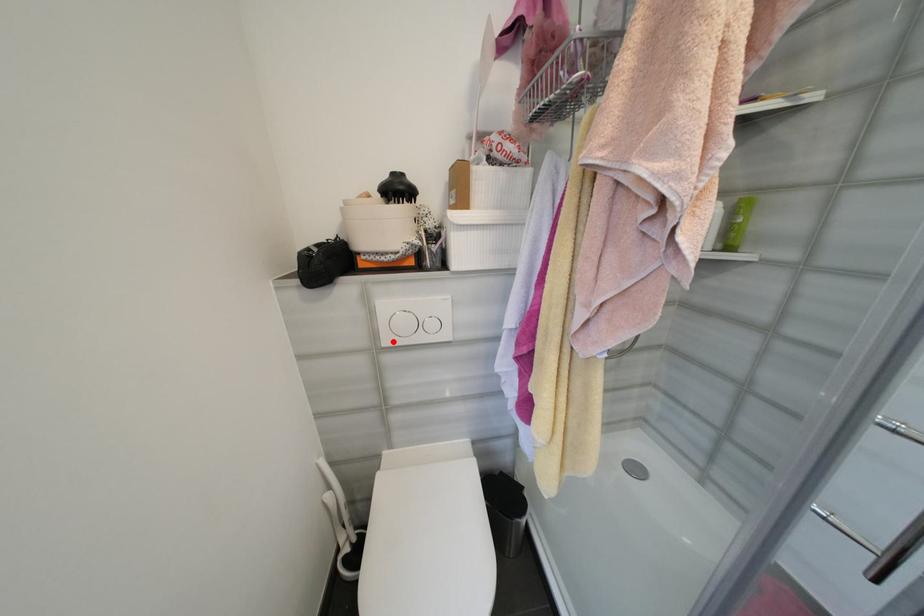
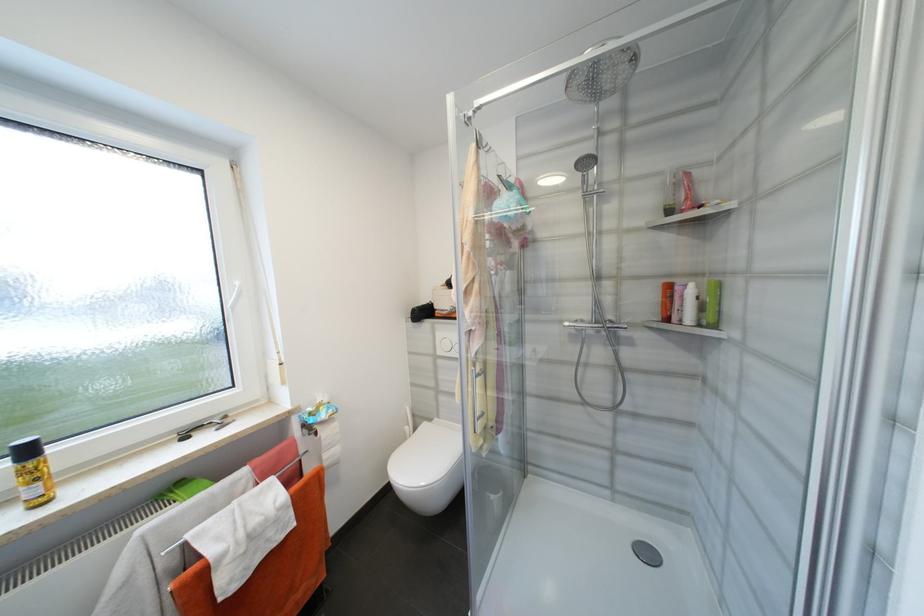
Question: I am providing you with two images of the same scene from different viewpoints. Image1 has a red point marked. In image2, the corresponding 3D location appears at what relative position? Reply with the corresponding letter.

Choices:
 (A) Closer
 (B) Farther

Answer: (B)